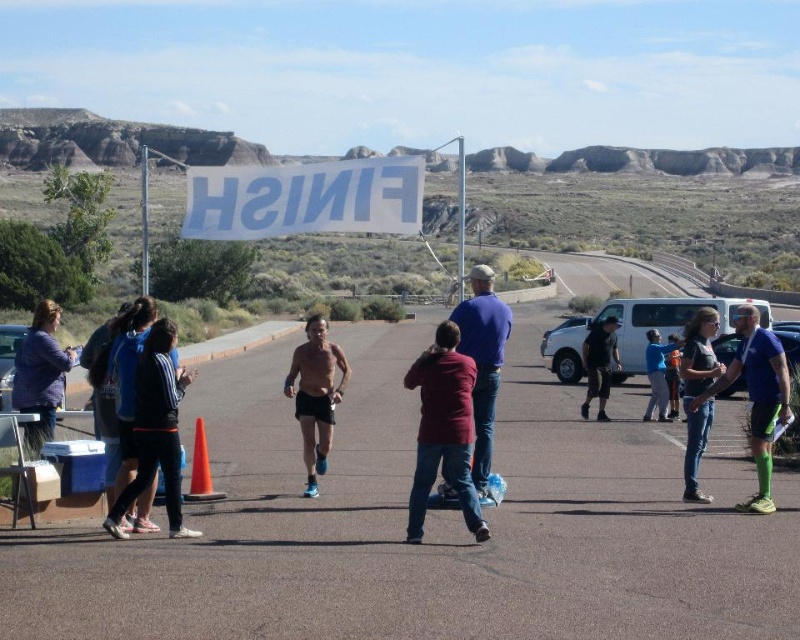
You are a photographer at the finish line and want to capture both the dark blue sweater at center and the blue fabric jacket at center in the same frame. Which object should you focus on to ensure both are visible?

You should focus on the dark blue sweater at center because it is larger than the blue fabric jacket at center, making it easier to include both in the frame.

You are a photographer at the finish line and want to capture a photo that includes both the shiny blue shorts at center and the orange plastic cone at center. Based on their positions, which object should you adjust your camera to focus on first to ensure both are in the frame?

The shiny blue shorts at center is positioned on the right side of orange plastic cone at center. To ensure both are in the frame, you should first focus on the orange plastic cone at center, as it is on the left, and then adjust the camera to include the shiny blue shorts at center on the right side.

You are a photographer at the finish line of a desert race. You want to take a photo that includes both the denim jeans at center and the orange plastic cone at center. Which object should you focus on first to ensure both are in the frame?

You should focus on the denim jeans at center first since it is closer to the viewer than the orange plastic cone at center, ensuring both are in the frame.